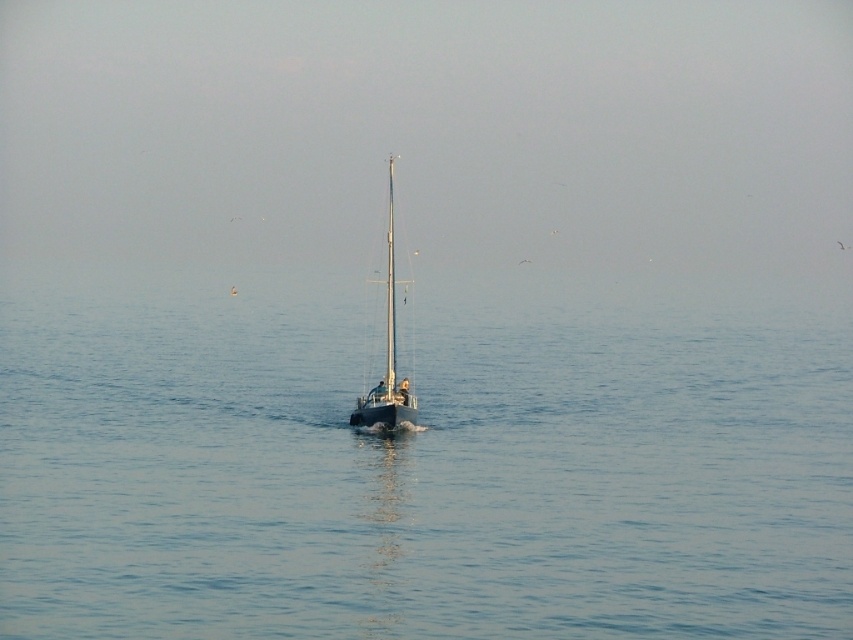
Between blue water at center and shiny silver mast at center, which one has less height?

Standing shorter between the two is blue water at center.

I want to click on blue water at center, so click(x=422, y=472).

Can you confirm if shiny black sailboat at center is bigger than shiny silver mast at center?

Yes.

Is shiny black sailboat at center to the left of shiny silver mast at center from the viewer's perspective?

Incorrect, shiny black sailboat at center is not on the left side of shiny silver mast at center.

Between point (387, 296) and point (393, 342), which one is positioned behind?

The point (387, 296) is more distant.

Locate an element on the screen. shiny black sailboat at center is located at coordinates (387, 353).

Can you confirm if blue water at center is bigger than shiny black sailboat at center?

Yes.

Can you confirm if blue water at center is positioned above shiny black sailboat at center?

Incorrect, blue water at center is not positioned above shiny black sailboat at center.

Does point (311, 596) come closer to viewer compared to point (387, 205)?

Yes, point (311, 596) is closer to viewer.

The width and height of the screenshot is (853, 640). What are the coordinates of `blue water at center` in the screenshot? It's located at (422, 472).